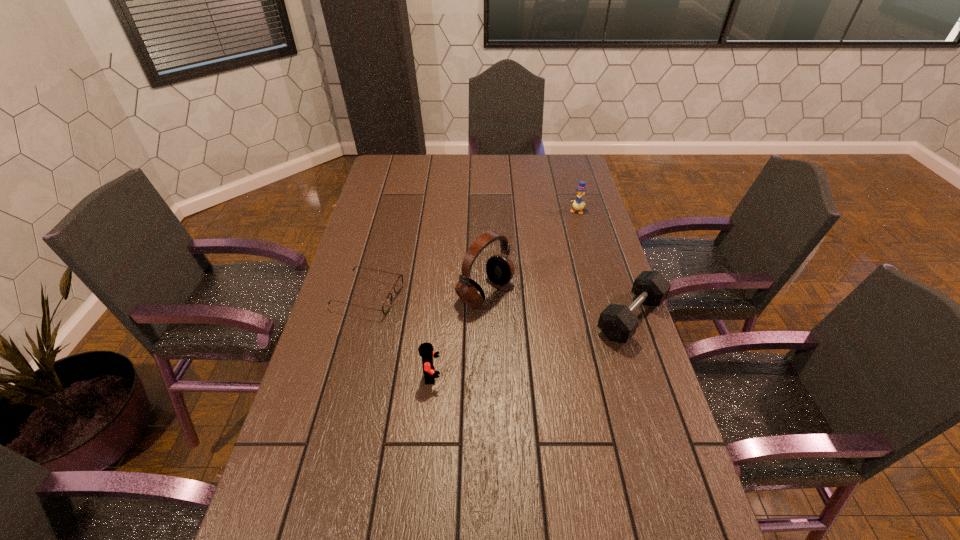
The image size is (960, 540). In order to click on free space located 0.400m on the front-facing side of the leftmost object in this screenshot , I will do `click(529, 328)`.

The height and width of the screenshot is (540, 960). Identify the location of vacant region located 0.350m on the front-facing side of the leftmost object. (512, 325).

At what (x,y) coordinates should I click in order to perform the action: click on free space located on the front-facing side of the leftmost object. Please return your answer as a coordinate pair (x, y). The height and width of the screenshot is (540, 960). Looking at the image, I should click on (495, 321).

You are a GUI agent. You are given a task and a screenshot of the screen. Output one action in this format:
    pyautogui.click(x=<x>, y=<y>)
    Task: Click on the vacant area situated 0.330m on the face of the farthest object, where the monocle is placed
    The image size is (960, 540).
    Given the screenshot: What is the action you would take?
    pyautogui.click(x=549, y=267)

In order to click on free space located 0.340m on the face of the farthest object, where the monocle is placed in this screenshot , I will do `click(548, 269)`.

Locate an element on the screen. The image size is (960, 540). vacant space located 0.050m on the face of the farthest object, where the monocle is placed is located at coordinates (571, 221).

At what (x,y) coordinates should I click in order to perform the action: click on vacant space located on the ear pads of the tallest object. Please return your answer as a coordinate pair (x, y). Image resolution: width=960 pixels, height=540 pixels. Looking at the image, I should click on pos(614,374).

Image resolution: width=960 pixels, height=540 pixels. I want to click on free space located on the ear pads of the tallest object, so click(549, 333).

You are a GUI agent. You are given a task and a screenshot of the screen. Output one action in this format:
    pyautogui.click(x=<x>, y=<y>)
    Task: Click on the vacant space located 0.280m on the ear pads of the tallest object
    This screenshot has height=540, width=960.
    Given the screenshot: What is the action you would take?
    pyautogui.click(x=588, y=357)

I want to click on object positioned at the left edge, so click(398, 285).